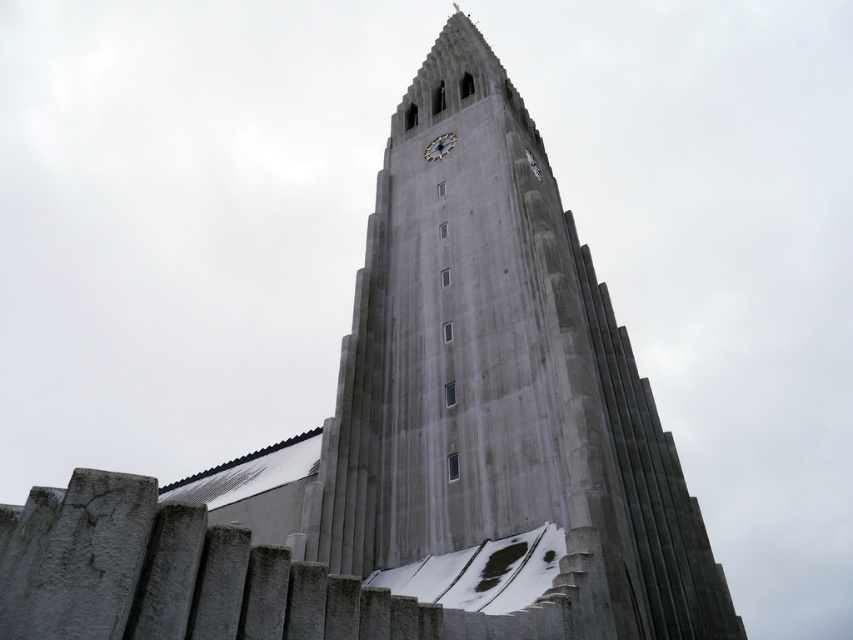
This screenshot has height=640, width=853. Describe the element at coordinates (198, 579) in the screenshot. I see `smooth concrete fence at lower left` at that location.

Does smooth concrete fence at lower left appear over white textured clock at upper center?

Actually, smooth concrete fence at lower left is below white textured clock at upper center.

Is point (183, 541) positioned after point (434, 138)?

No.

Identify the location of smooth concrete fence at lower left. This screenshot has width=853, height=640. (198, 579).